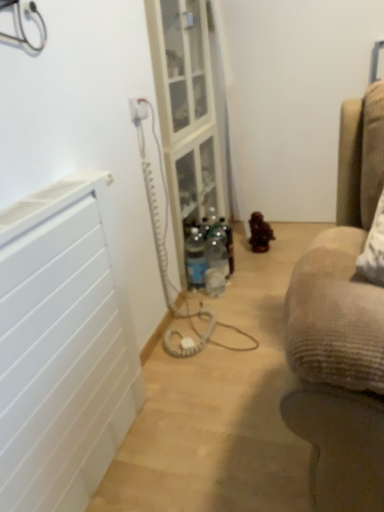
Question: Is clear plastic bottle at center wider than white plastic electric outlet at upper center?

Choices:
 (A) no
 (B) yes

Answer: (B)

Question: Is clear plastic bottle at center not near white plastic electric outlet at upper center?

Choices:
 (A) yes
 (B) no

Answer: (B)

Question: Can you confirm if clear plastic bottle at center is positioned to the right of white plastic electric outlet at upper center?

Choices:
 (A) no
 (B) yes

Answer: (B)

Question: Is clear plastic bottle at center in contact with white plastic electric outlet at upper center?

Choices:
 (A) yes
 (B) no

Answer: (B)

Question: From a real-world perspective, is clear plastic bottle at center on top of white plastic electric outlet at upper center?

Choices:
 (A) no
 (B) yes

Answer: (A)

Question: Is the depth of clear plastic bottle at center greater than that of white plastic electric outlet at upper center?

Choices:
 (A) no
 (B) yes

Answer: (B)

Question: From a real-world perspective, is clear plastic bottle at center over clear glass shelf at center?

Choices:
 (A) no
 (B) yes

Answer: (A)

Question: Is clear plastic bottle at center to the right of clear glass shelf at center from the viewer's perspective?

Choices:
 (A) yes
 (B) no

Answer: (A)

Question: Considering the relative sizes of clear plastic bottle at center and clear glass shelf at center in the image provided, is clear plastic bottle at center smaller than clear glass shelf at center?

Choices:
 (A) yes
 (B) no

Answer: (A)

Question: Is the position of clear plastic bottle at center less distant than that of clear glass shelf at center?

Choices:
 (A) no
 (B) yes

Answer: (A)

Question: Can you confirm if clear plastic bottle at center is positioned to the left of clear glass shelf at center?

Choices:
 (A) no
 (B) yes

Answer: (A)

Question: Can you confirm if clear plastic bottle at center is thinner than clear glass shelf at center?

Choices:
 (A) yes
 (B) no

Answer: (A)

Question: Is white matte radiator at left next to clear glass shelf at center and touching it?

Choices:
 (A) yes
 (B) no

Answer: (B)